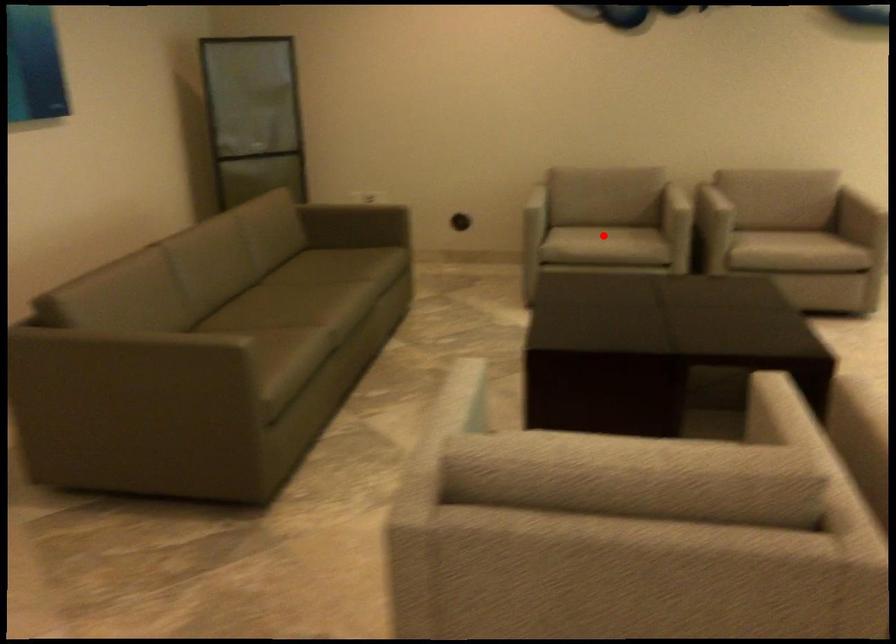
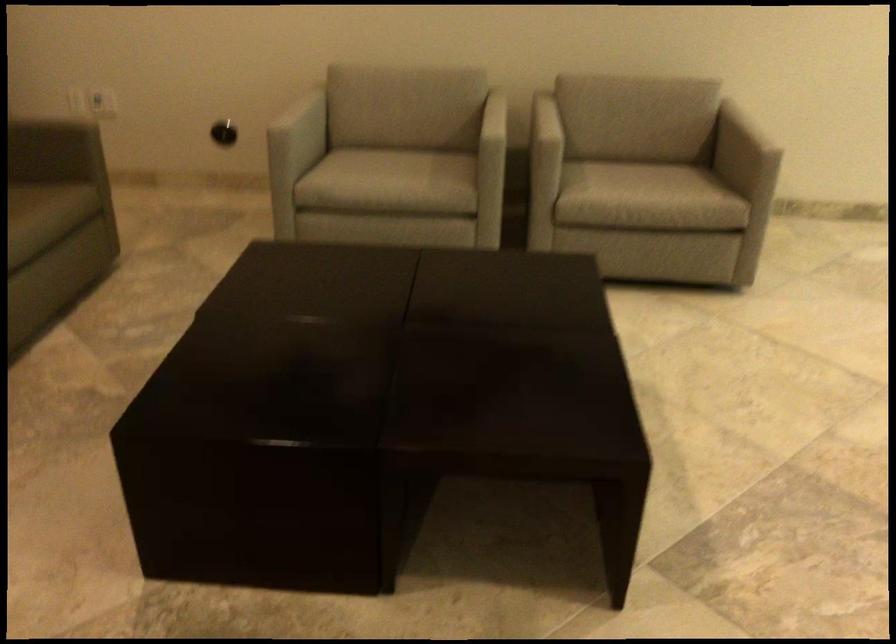
Question: I am providing you with two images of the same scene from different viewpoints. A red point is shown in image1. For the corresponding object point in image2, is it positioned nearer or farther from the camera?

Choices:
 (A) Nearer
 (B) Farther

Answer: (A)